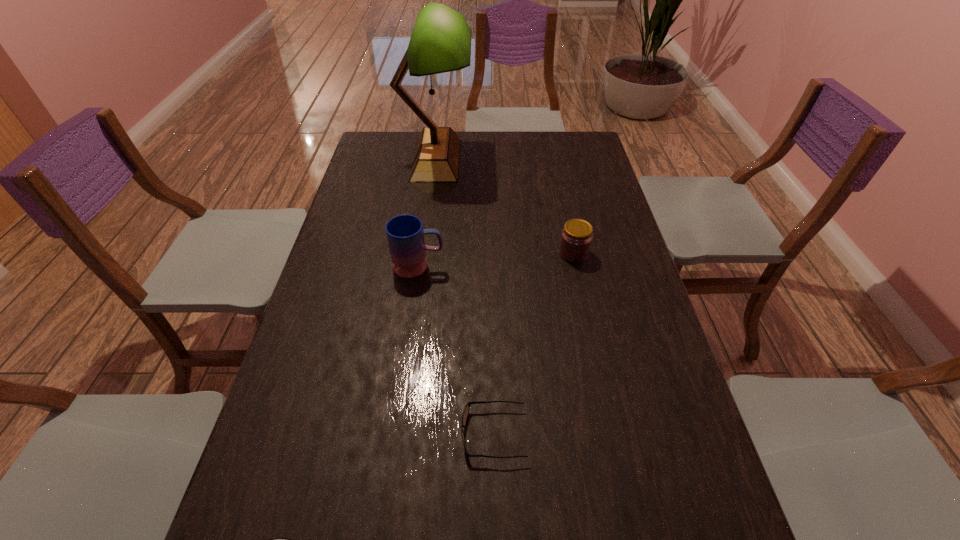
You are a GUI agent. You are given a task and a screenshot of the screen. Output one action in this format:
    pyautogui.click(x=<x>, y=<y>)
    Task: Click on the vacant space located on the front-facing side of the fourth tallest object
    Image resolution: width=960 pixels, height=540 pixels.
    Given the screenshot: What is the action you would take?
    pyautogui.click(x=295, y=434)

What are the coordinates of `vacant point located 0.170m on the front-facing side of the fourth tallest object` in the screenshot? It's located at (380, 434).

Locate an element on the screen. This screenshot has width=960, height=540. free location located 0.130m on the front-facing side of the fourth tallest object is located at coordinates (399, 434).

Where is `object present at the far edge`? The height and width of the screenshot is (540, 960). object present at the far edge is located at coordinates (440, 42).

I want to click on object that is positioned at the left edge, so click(440, 42).

Find the location of `object at the right edge`. object at the right edge is located at coordinates (576, 238).

Find the location of a particular element. This screenshot has width=960, height=540. object located in the far left corner section of the desktop is located at coordinates (440, 42).

Where is `vacant region at the far edge of the desktop`? vacant region at the far edge of the desktop is located at coordinates (462, 132).

Identify the location of vacant region at the left edge of the desktop. The image size is (960, 540). pos(334,320).

In the image, there is a desktop. Identify the location of vacant space at the right edge. (580, 188).